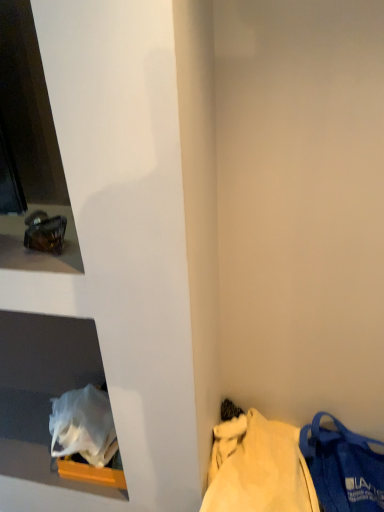
Question: In the image, is white plastic bag at lower left on the left side or the right side of matte glass ashtray at upper left?

Choices:
 (A) right
 (B) left

Answer: (B)

Question: Looking at their shapes, would you say white plastic bag at lower left is wider or thinner than matte glass ashtray at upper left?

Choices:
 (A) thin
 (B) wide

Answer: (B)

Question: Which of these objects is positioned farthest from the blue fabric tote bag at lower right?

Choices:
 (A) matte glass ashtray at upper left
 (B) matte blue fabric bag at lower right
 (C) white plastic bag at lower left

Answer: (A)

Question: Which of these objects is positioned farthest from the white plastic bag at lower left?

Choices:
 (A) matte blue fabric bag at lower right
 (B) blue fabric tote bag at lower right
 (C) matte glass ashtray at upper left

Answer: (A)